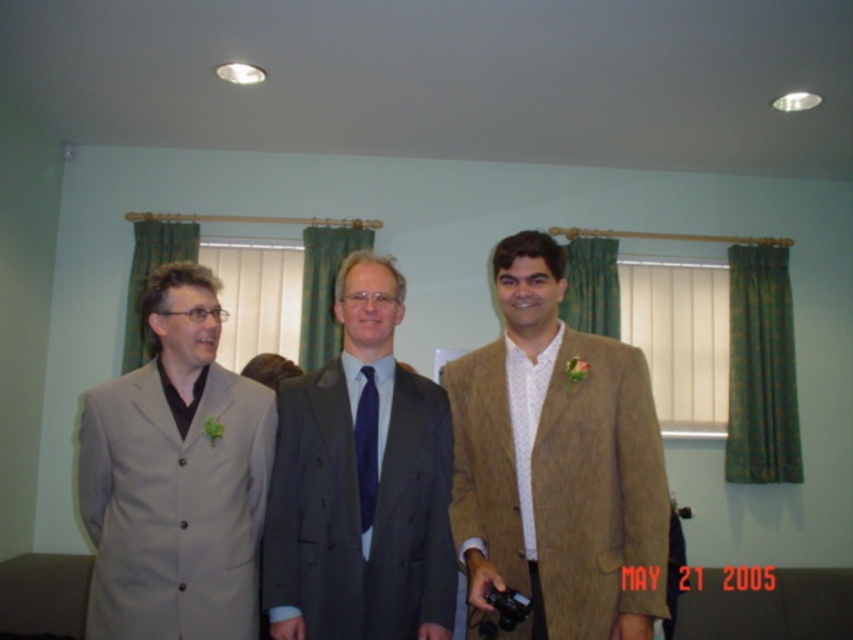
You are a photographer at a wedding and need to determine which suit is more appropriate to focus on for a group photo. Based on the scene description, which of the two suits, the tan textured suit at center or the matte gray suit at center, is bigger in size and thus might be better to highlight in the composition?

The tan textured suit at center is larger in size than the matte gray suit at center, so it might be better to highlight the tan textured suit at center in the composition.

You are standing in a room where three men are dressed formally. You notice a point at coordinates (556, 461). What type of clothing item is located at that specific point?

The tan textured suit at center is located at point (556, 461).